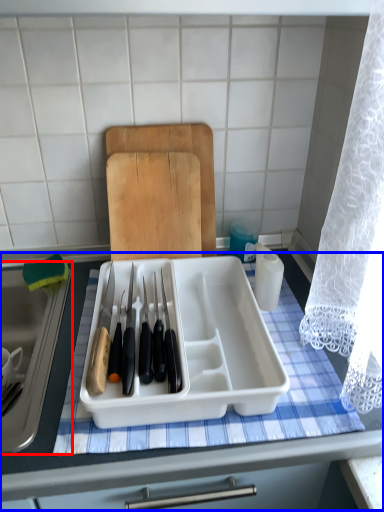
Question: Which point is further to the camera, sink (highlighted by a red box) or table (highlighted by a blue box)?

Choices:
 (A) sink
 (B) table

Answer: (A)